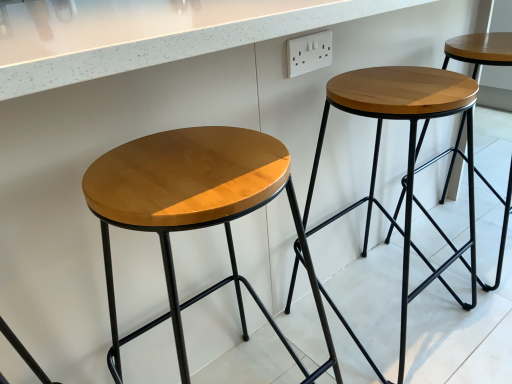
Question: Can you confirm if matte wood stool at center, which is counted as the first stool, starting from the left, is positioned to the left of wooden stool at center, the second stool when ordered from left to right?

Choices:
 (A) no
 (B) yes

Answer: (B)

Question: Does matte wood stool at center, which is the second stool in right-to-left order, have a greater height compared to wooden stool at center, the second stool when ordered from left to right?

Choices:
 (A) yes
 (B) no

Answer: (A)

Question: Can you confirm if matte wood stool at center, which is counted as the first stool, starting from the left, is smaller than wooden stool at center, the second stool when ordered from left to right?

Choices:
 (A) no
 (B) yes

Answer: (B)

Question: From a real-world perspective, is matte wood stool at center, which is counted as the first stool, starting from the left, below wooden stool at center, placed as the first stool when sorted from right to left?

Choices:
 (A) no
 (B) yes

Answer: (A)

Question: From a real-world perspective, is matte wood stool at center, which is counted as the first stool, starting from the left, located higher than wooden stool at center, placed as the first stool when sorted from right to left?

Choices:
 (A) yes
 (B) no

Answer: (A)

Question: Considering the relative positions of matte wood stool at center, which is the second stool in right-to-left order, and wooden stool at center, placed as the first stool when sorted from right to left, in the image provided, is matte wood stool at center, which is the second stool in right-to-left order, to the right of wooden stool at center, placed as the first stool when sorted from right to left, from the viewer's perspective?

Choices:
 (A) yes
 (B) no

Answer: (B)

Question: Can you confirm if wooden stool at center, the second stool when ordered from left to right, is shorter than matte wood stool at center, which is counted as the first stool, starting from the left?

Choices:
 (A) no
 (B) yes

Answer: (B)

Question: From the image's perspective, is wooden stool at center, the second stool when ordered from left to right, over matte wood stool at center, which is the second stool in right-to-left order?

Choices:
 (A) yes
 (B) no

Answer: (A)

Question: Are wooden stool at center, the second stool when ordered from left to right, and matte wood stool at center, which is the second stool in right-to-left order, far apart?

Choices:
 (A) no
 (B) yes

Answer: (A)

Question: Is wooden stool at center, the second stool when ordered from left to right, in front of matte wood stool at center, which is counted as the first stool, starting from the left?

Choices:
 (A) yes
 (B) no

Answer: (B)

Question: Does wooden stool at center, the second stool when ordered from left to right, have a larger size compared to matte wood stool at center, which is the second stool in right-to-left order?

Choices:
 (A) yes
 (B) no

Answer: (A)

Question: Is wooden stool at center, placed as the first stool when sorted from right to left, further to the viewer compared to matte wood stool at center, which is the second stool in right-to-left order?

Choices:
 (A) yes
 (B) no

Answer: (A)

Question: Does matte wood stool at center, which is the second stool in right-to-left order, have a lesser height compared to white plastic outlet at upper center?

Choices:
 (A) no
 (B) yes

Answer: (A)